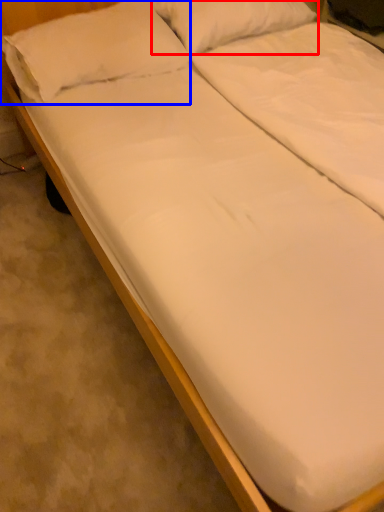
Question: Which object appears closest to the camera in this image, pillow (highlighted by a red box) or pillow (highlighted by a blue box)?

Choices:
 (A) pillow
 (B) pillow

Answer: (B)